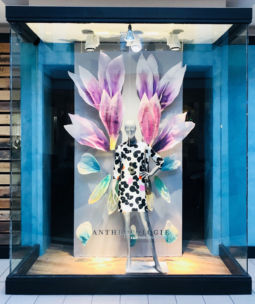
Where is `mannequin`? This screenshot has height=304, width=255. mannequin is located at coordinates (132, 163).